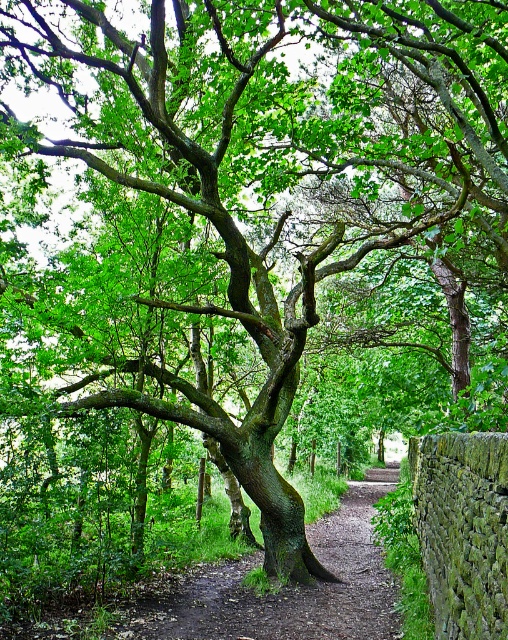
Can you confirm if dirt path at center is positioned to the right of green mossy stone wall at lower right?

Incorrect, dirt path at center is not on the right side of green mossy stone wall at lower right.

You are a GUI agent. You are given a task and a screenshot of the screen. Output one action in this format:
    pyautogui.click(x=<x>, y=<y>)
    Task: Click on the dirt path at center
    The height and width of the screenshot is (640, 508).
    Given the screenshot: What is the action you would take?
    coord(285,588)